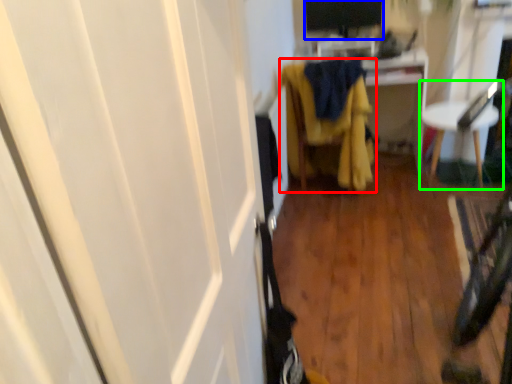
Question: Based on their relative distances, which object is nearer to furniture (highlighted by a red box)? Choose from computer monitor (highlighted by a blue box) and furniture (highlighted by a green box).

Choices:
 (A) computer monitor
 (B) furniture

Answer: (B)